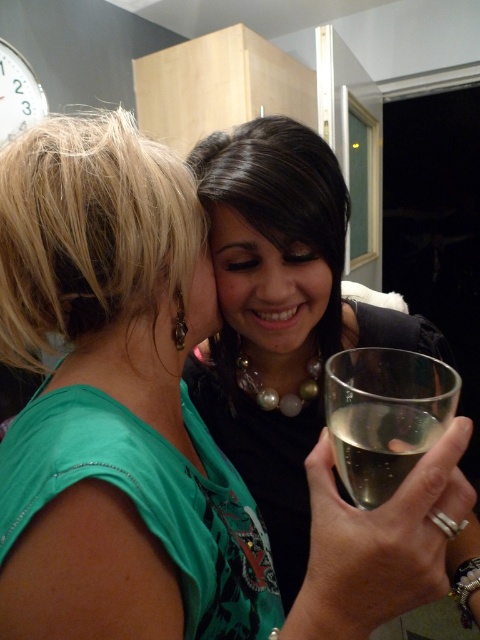
Can you confirm if clear glass wine glass at lower right is positioned to the left of smooth skin at center?

Incorrect, clear glass wine glass at lower right is not on the left side of smooth skin at center.

Who is taller, clear glass wine glass at lower right or smooth skin at center?

clear glass wine glass at lower right is taller.

You are a GUI agent. You are given a task and a screenshot of the screen. Output one action in this format:
    pyautogui.click(x=<x>, y=<y>)
    Task: Click on the clear glass wine glass at lower right
    The image size is (480, 640).
    Given the screenshot: What is the action you would take?
    pyautogui.click(x=384, y=416)